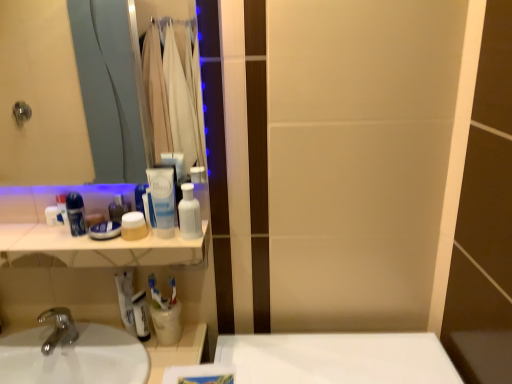
Locate an element on the screen. Image resolution: width=512 pixels, height=384 pixels. free spot to the right of silver metallic faucet at lower left is located at coordinates (111, 345).